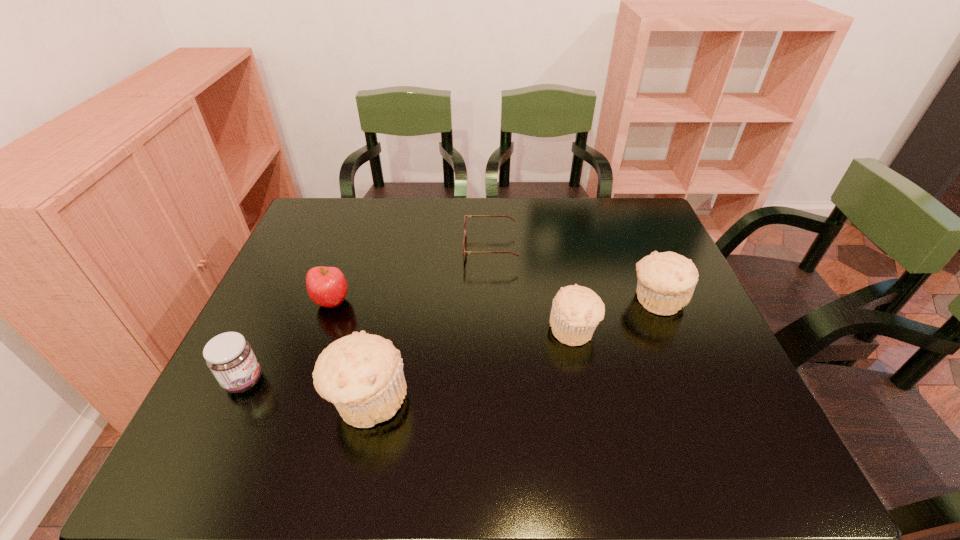
You are a GUI agent. You are given a task and a screenshot of the screen. Output one action in this format:
    pyautogui.click(x=<x>, y=<y>)
    Task: Click on the vacant space situated 0.210m on the left of the nearest muffin
    
    Given the screenshot: What is the action you would take?
    pyautogui.click(x=228, y=400)

The image size is (960, 540). I want to click on vacant space located 0.230m on the right of the second muffin from left to right, so click(692, 329).

Where is `vacant area situated 0.220m on the front of the fifth shortest object`? The image size is (960, 540). vacant area situated 0.220m on the front of the fifth shortest object is located at coordinates (698, 399).

This screenshot has width=960, height=540. What are the coordinates of `free space located on the front of the apple` in the screenshot? It's located at (306, 375).

This screenshot has height=540, width=960. In order to click on vacant space located at the front view of the fourth object from left to right in this screenshot , I will do `click(424, 248)`.

At what (x,y) coordinates should I click in order to perform the action: click on vacant space located at the front view of the fourth object from left to right. Please return your answer as a coordinate pair (x, y). Image resolution: width=960 pixels, height=540 pixels. Looking at the image, I should click on (354, 248).

The image size is (960, 540). Identify the location of vacant area located at the front view of the fourth object from left to right. (364, 248).

Image resolution: width=960 pixels, height=540 pixels. Find the location of `vacant space located on the front label of the jam`. vacant space located on the front label of the jam is located at coordinates (295, 381).

This screenshot has height=540, width=960. In order to click on object situated at the far edge in this screenshot , I will do `click(465, 236)`.

In order to click on muffin situated at the near edge in this screenshot , I will do `click(362, 374)`.